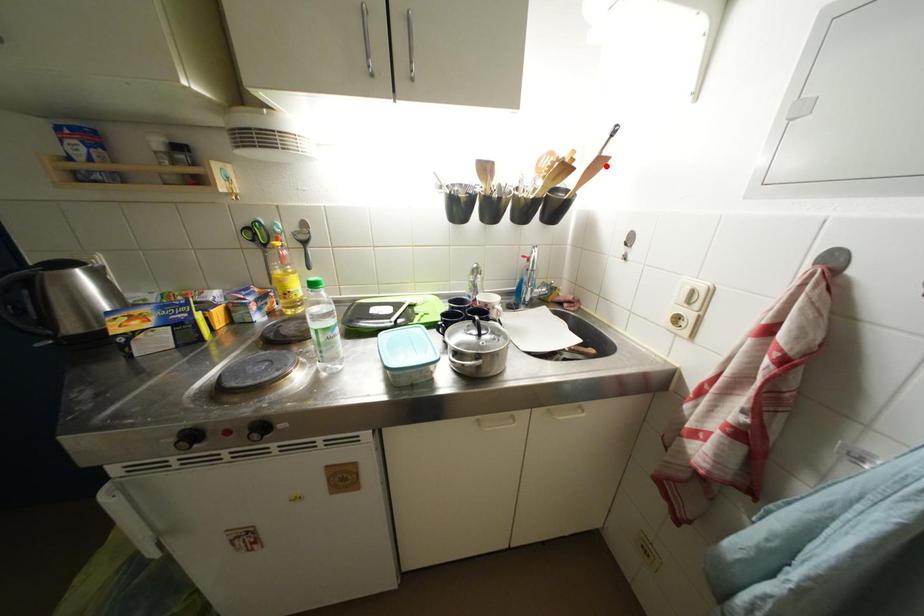
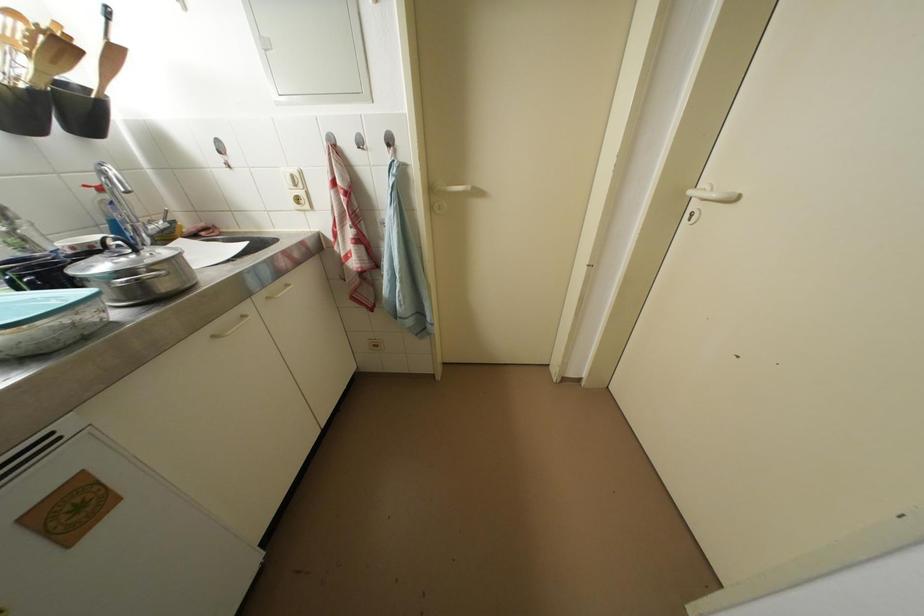
In the second image, find the point that corresponds to the highlighted location in the first image.

(120, 55)